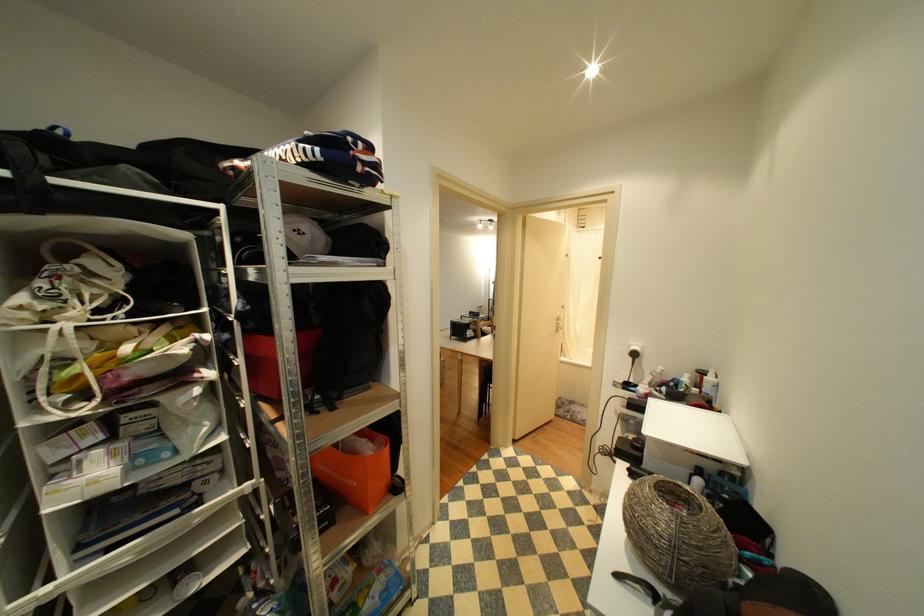
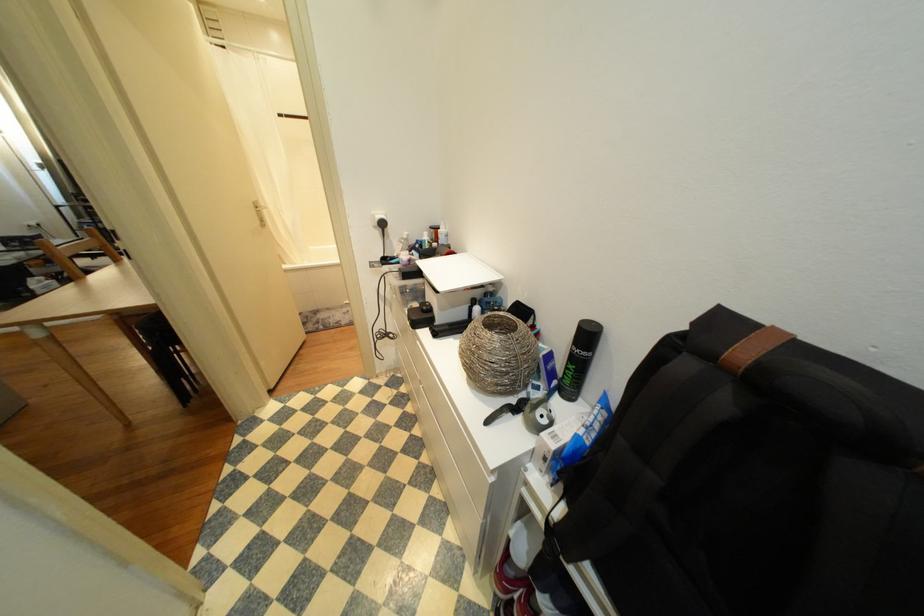
The point at (564, 323) is marked in the first image. Where is the corresponding point in the second image?

(262, 211)